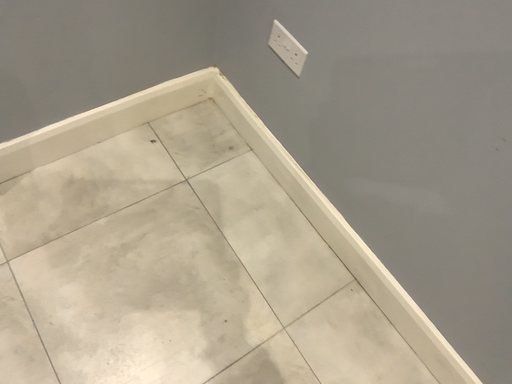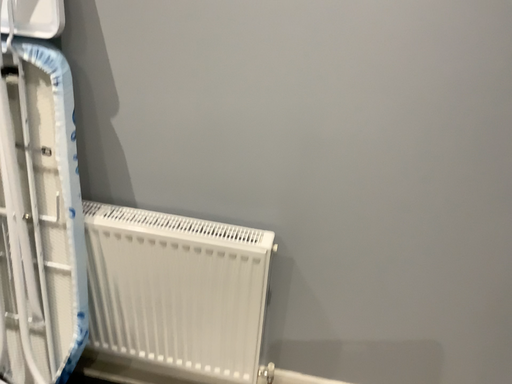
Question: Which way did the camera rotate in the video?

Choices:
 (A) rotated downward
 (B) rotated upward

Answer: (B)